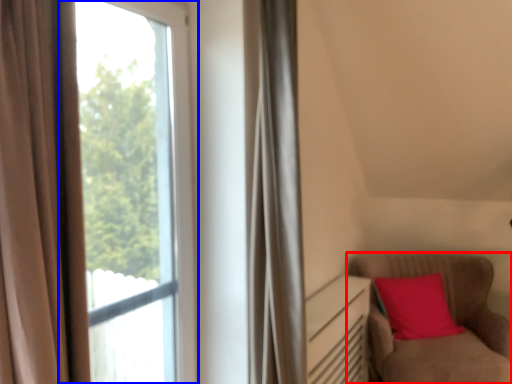
Question: Which object appears farthest to the camera in this image, furniture (highlighted by a red box) or window (highlighted by a blue box)?

Choices:
 (A) furniture
 (B) window

Answer: (A)